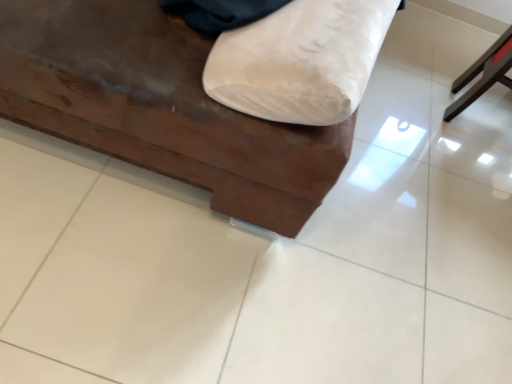
What do you see at coordinates (159, 107) in the screenshot?
I see `brown wooden bed at upper left` at bounding box center [159, 107].

This screenshot has height=384, width=512. What are the coordinates of `brown wooden bed at upper left` in the screenshot? It's located at (159, 107).

In order to face brown wooden bed at upper left, should I rotate leftwards or rightwards?

It's best to rotate left around 12.311 degrees.

Find the location of a particular element. brown wooden bed at upper left is located at coordinates (159, 107).